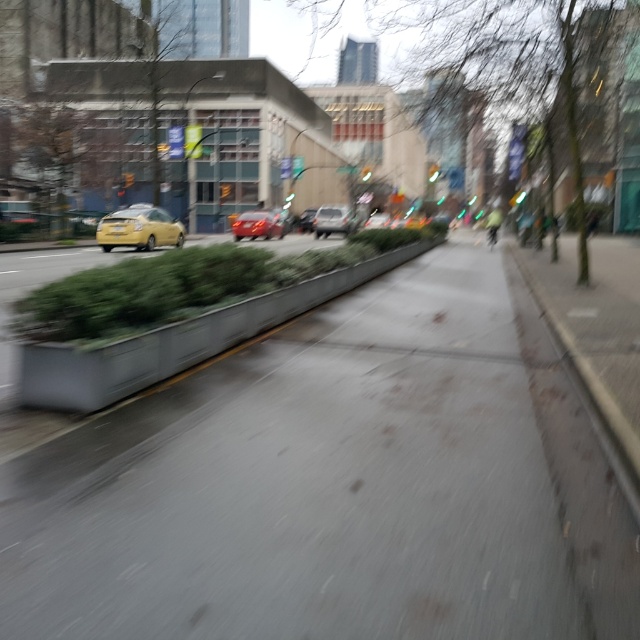
Between brown leafless tree at left and metallic silver sedan at center, which one is positioned lower?

metallic silver sedan at center

Between brown leafless tree at left and metallic silver sedan at center, which one has more height?

brown leafless tree at left is taller.

Which is in front, point (67, 125) or point (337, 227)?

Positioned in front is point (67, 125).

Locate an element on the screen. The width and height of the screenshot is (640, 640). brown leafless tree at left is located at coordinates (54, 154).

Consider the image. Is green leafy tree at center below concrete at center?

No.

Is point (566, 124) behind point (60, 364)?

Yes.

Identify the location of green leafy tree at center. The width and height of the screenshot is (640, 640). (x=524, y=60).

Is concrete at center smaller than shiny red car at center?

Indeed, concrete at center has a smaller size compared to shiny red car at center.

Which is behind, point (44, 397) or point (266, 216)?

Positioned behind is point (266, 216).

At what (x,y) coordinates should I click in order to perform the action: click on concrete at center. Please return your answer as a coordinate pair (x, y). This screenshot has width=640, height=640. Looking at the image, I should click on (179, 340).